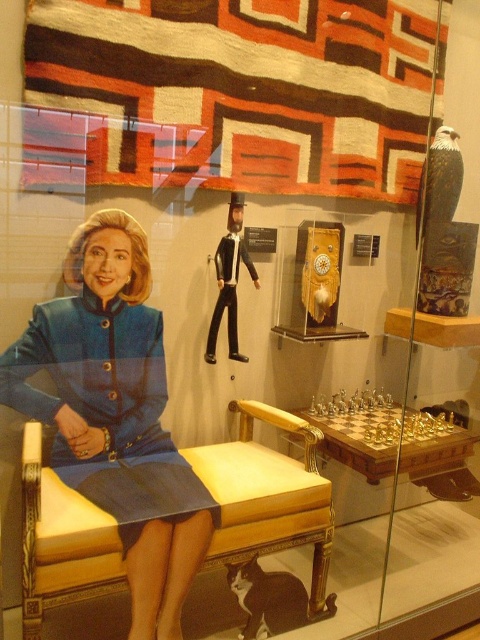
Between blue fabric dress at center and yellow upholstered chair at center, which one has less height?

Standing shorter between the two is yellow upholstered chair at center.

Measure the distance from blue fabric dress at center to yellow upholstered chair at center.

A distance of 13.78 inches exists between blue fabric dress at center and yellow upholstered chair at center.

What do you see at coordinates (113, 410) in the screenshot? I see `blue fabric dress at center` at bounding box center [113, 410].

In order to click on blue fabric dress at center in this screenshot , I will do `click(113, 410)`.